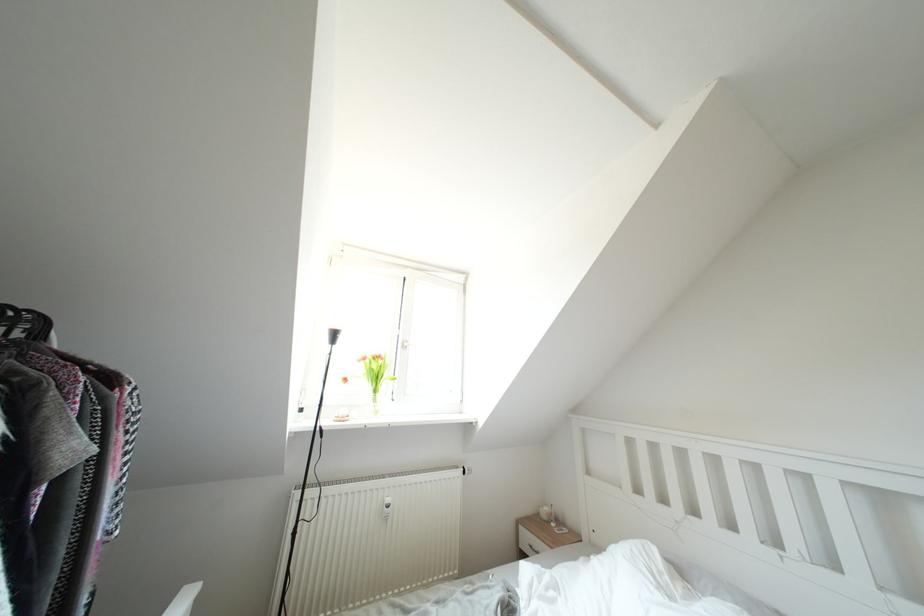
Identify the location of white window handle. (405, 344).